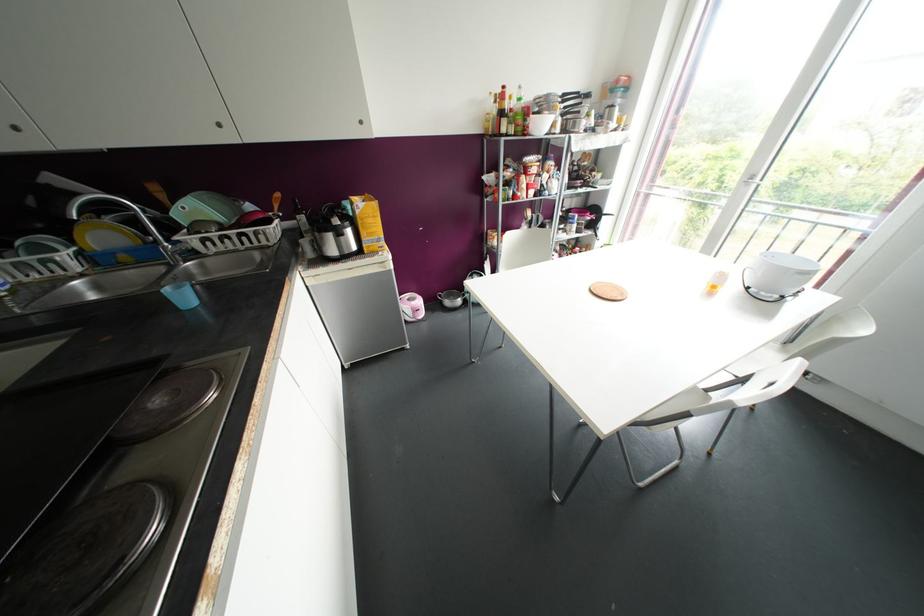
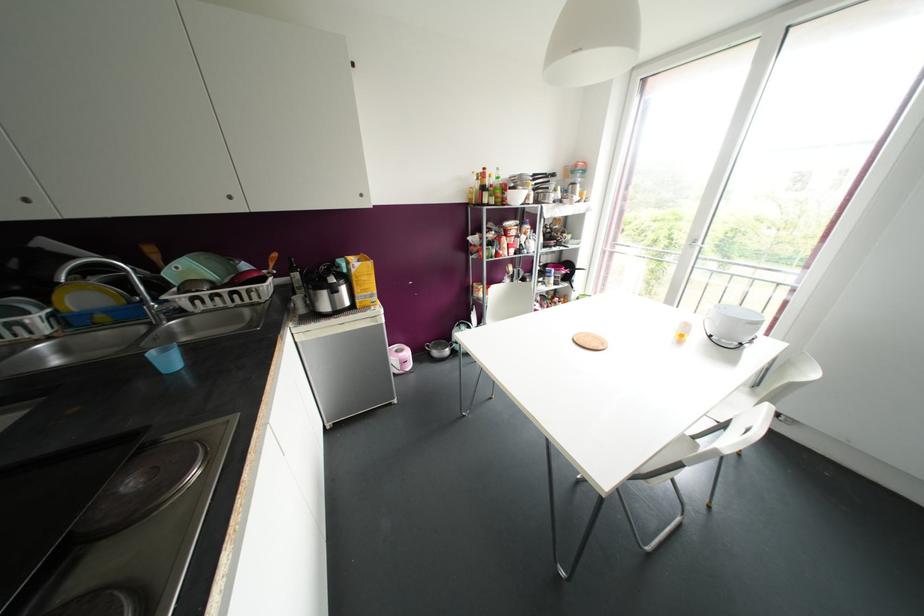
Find the pixel in the second image that matches (x=123, y=257) in the first image.

(101, 317)